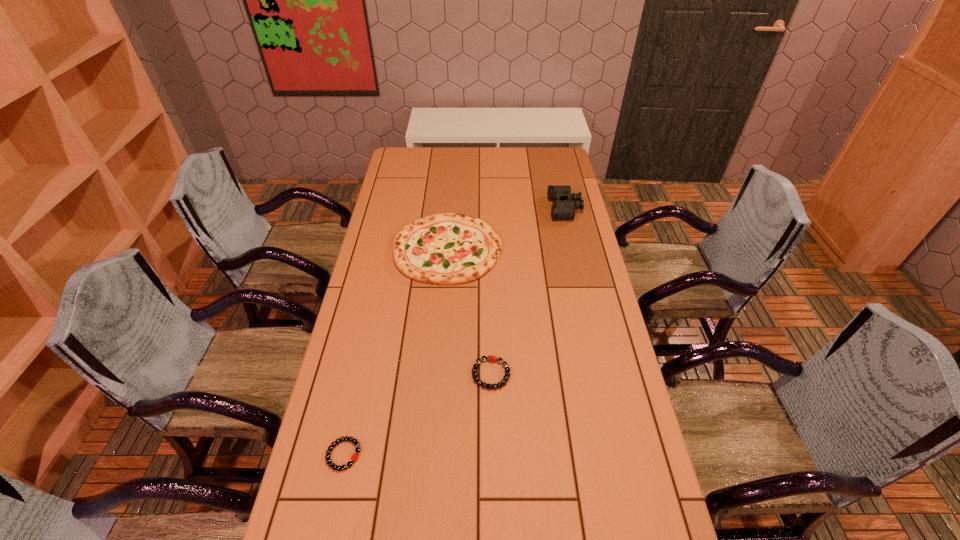
I want to click on vacant region between the shorter bracelet and the right bracelet, so click(x=418, y=414).

Where is `vacant space that's between the binoculars and the pizza`? The height and width of the screenshot is (540, 960). vacant space that's between the binoculars and the pizza is located at coordinates (507, 228).

At what (x,y) coordinates should I click in order to perform the action: click on free space that is in between the nearer bracelet and the rightmost object. Please return your answer as a coordinate pair (x, y). This screenshot has width=960, height=540. Looking at the image, I should click on (454, 332).

This screenshot has width=960, height=540. Find the location of `free space between the shorter bracelet and the pizza`. free space between the shorter bracelet and the pizza is located at coordinates (396, 352).

Locate an element on the screen. Image resolution: width=960 pixels, height=540 pixels. empty space between the tallest object and the nearest object is located at coordinates (x=454, y=332).

Where is `free space between the second tallest object and the second nearest object`? free space between the second tallest object and the second nearest object is located at coordinates (469, 312).

At what (x,y) coordinates should I click in order to perform the action: click on unoccupied area between the left bracelet and the taller bracelet. Please return your answer as a coordinate pair (x, y). Image resolution: width=960 pixels, height=540 pixels. Looking at the image, I should click on (418, 414).

The width and height of the screenshot is (960, 540). In order to click on unoccupied area between the tallest object and the left bracelet in this screenshot , I will do `click(454, 332)`.

I want to click on vacant space that's between the pizza and the binoculars, so click(507, 228).

At what (x,y) coordinates should I click in order to perform the action: click on blank region between the binoculars and the farther bracelet. Please return your answer as a coordinate pair (x, y). The height and width of the screenshot is (540, 960). Looking at the image, I should click on (528, 291).